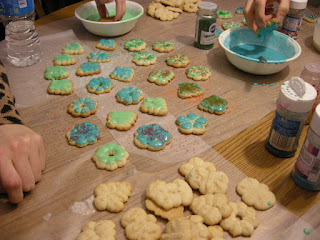
Identify the location of white bowl. (127, 25), (244, 68).